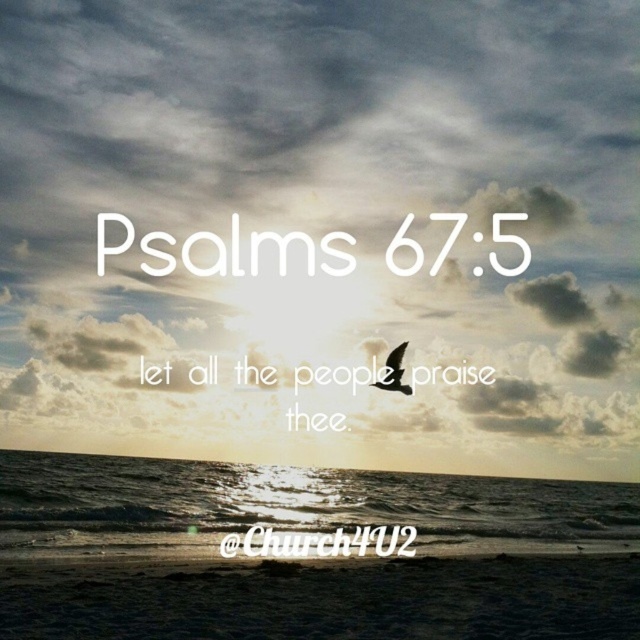
Based on the photo, you are an artist trying to paint this coastal scene. You want to ensure the cloudy sky at upper center and the glistening water at lower center are proportionally accurate. Based on the scene, which of these two elements should you make larger in your painting?

The cloudy sky at upper center should be made larger in the painting since it has a larger size compared to the glistening water at lower center according to the description.

You are a birdwatcher observing the cloudy sky at upper center and the matte black bird at center. Which object is located to the right of the other?

The matte black bird at center is located to the right of the cloudy sky at upper center because the cloudy sky at upper center is positioned on the left side of the matte black bird at center.